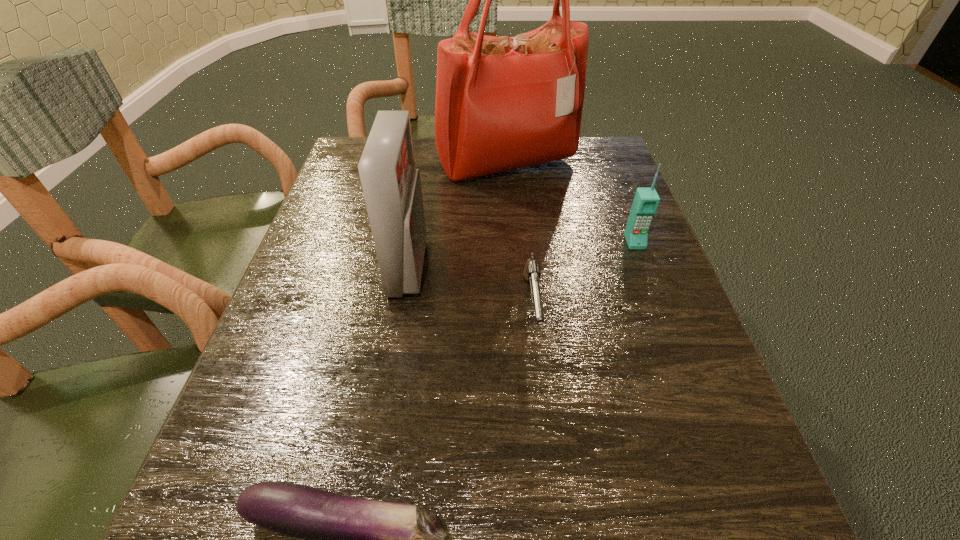
This screenshot has height=540, width=960. I want to click on the third closest object to the gun, so click(x=348, y=539).

You are a GUI agent. You are given a task and a screenshot of the screen. Output one action in this format:
    pyautogui.click(x=<x>, y=<y>)
    Task: Click on the vacant position in the image that satisfies the following two spatial constraints: 1. on the keypad of the third tallest object; 2. on the front-facing side of the fourth shortest object
    The image size is (960, 540).
    Given the screenshot: What is the action you would take?
    pyautogui.click(x=644, y=268)